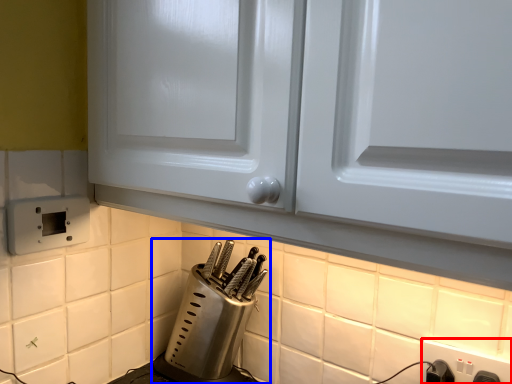
Question: Which of the following is the closest to the observer, electric outlet (highlighted by a red box) or kitchen appliance (highlighted by a blue box)?

Choices:
 (A) electric outlet
 (B) kitchen appliance

Answer: (A)